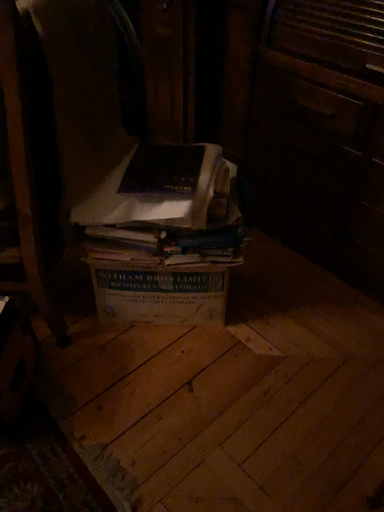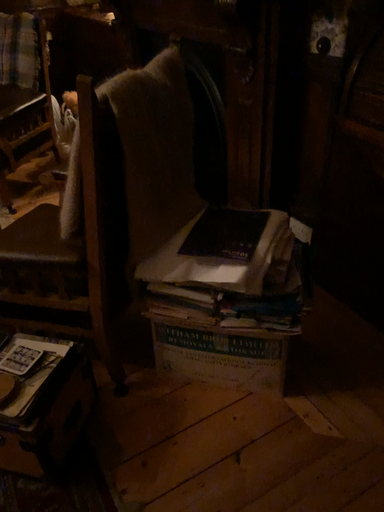
Question: Which way did the camera rotate in the video?

Choices:
 (A) rotated left
 (B) rotated right

Answer: (A)